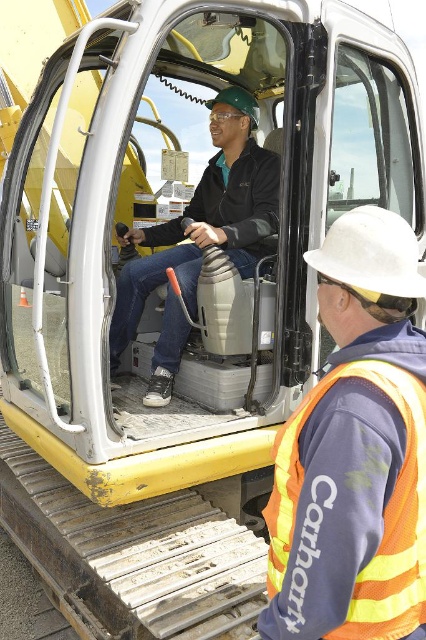
You are a safety inspector checking the construction site. You notice the matte black jacket at center and the orange reflective safety vest at lower right. According to safety protocols, which person should be closer to the excavator for effective communication?

The orange reflective safety vest at lower right should be closer to the excavator because the matte black jacket at center is located above it, indicating the operator is inside the cabin. Effective communication requires the observer to be near the operator.

You are a safety inspector evaluating the construction site. You notice the matte black jacket at center and the orange reflective safety vest at lower right. Which worker is standing closer to the excavator?

The orange reflective safety vest at lower right is closer to the excavator because the matte black jacket at center is much taller than it, indicating the latter is the operator inside the cabin while the former is outside near the machine.